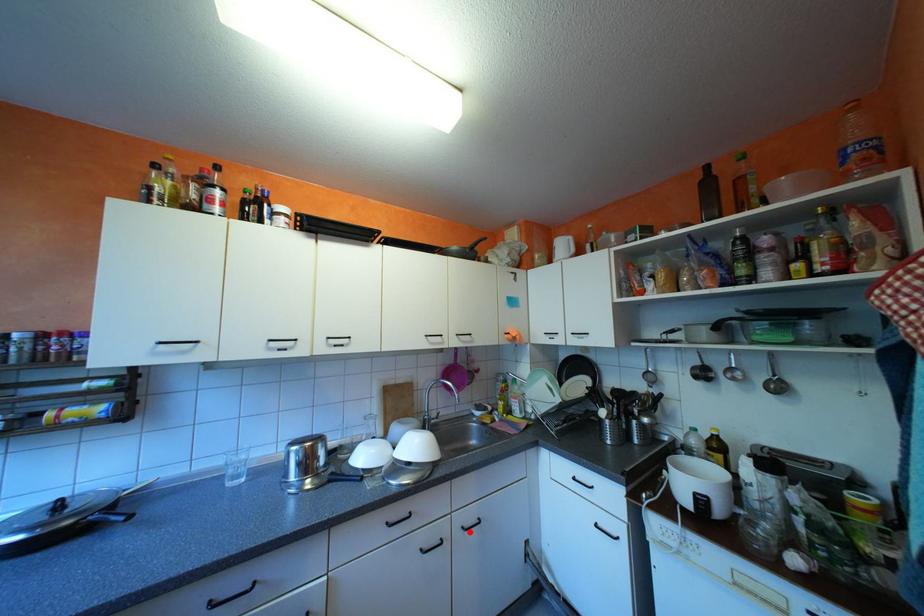
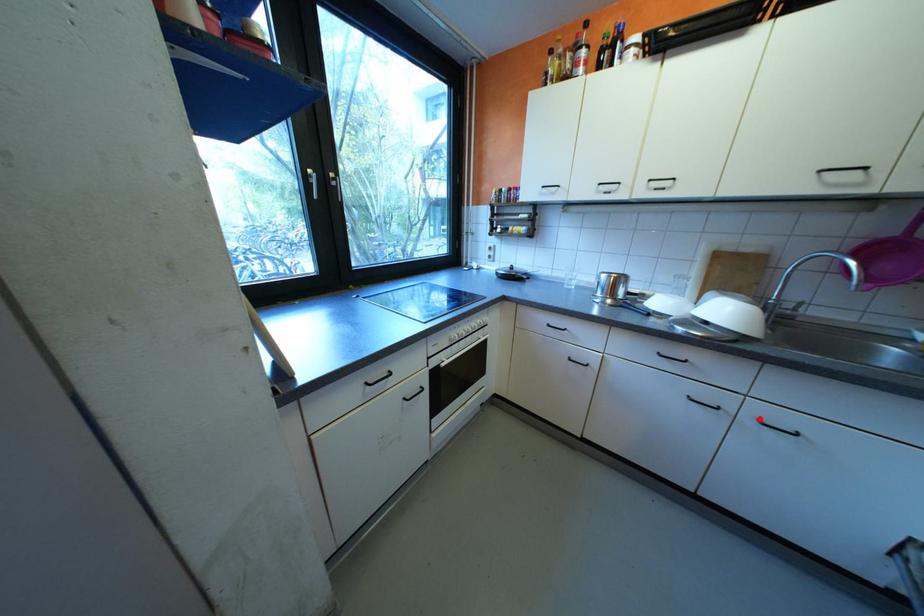
I am providing you with two images of the same scene from different viewpoints. A red point is marked on the first image and another point is marked on the second image. Does the point marked in image1 correspond to the same location as the one in image2?

Yes